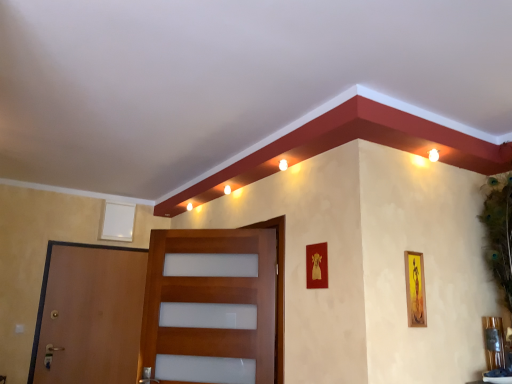
Question: Is the depth of brown wooden door at left, arranged as the first door when viewed from the left, less than that of white matte picture frame at upper left, the first picture frame in the left-to-right sequence?

Choices:
 (A) yes
 (B) no

Answer: (A)

Question: Would you say brown wooden door at left, positioned as the second door in right-to-left order, is outside white matte picture frame at upper left, arranged as the third picture frame when viewed from the right?

Choices:
 (A) yes
 (B) no

Answer: (A)

Question: Is white matte picture frame at upper left, the first picture frame positioned from the back, at the back of brown wooden door at left, which is counted as the first door, starting from the back?

Choices:
 (A) yes
 (B) no

Answer: (B)

Question: Are brown wooden door at left, arranged as the first door when viewed from the left, and white matte picture frame at upper left, arranged as the third picture frame when viewed from the front, far apart?

Choices:
 (A) no
 (B) yes

Answer: (A)

Question: Considering the relative sizes of brown wooden door at left, arranged as the first door when viewed from the left, and white matte picture frame at upper left, arranged as the third picture frame when viewed from the front, in the image provided, is brown wooden door at left, arranged as the first door when viewed from the left, shorter than white matte picture frame at upper left, arranged as the third picture frame when viewed from the front,?

Choices:
 (A) yes
 (B) no

Answer: (B)

Question: Is gold metallic picture frame at center, marked as the second picture frame in a front-to-back arrangement, taller or shorter than yellow matte picture frame at right, which is counted as the first picture frame, starting from the right?

Choices:
 (A) tall
 (B) short

Answer: (B)

Question: Considering the positions of gold metallic picture frame at center, the second picture frame in the back-to-front sequence, and yellow matte picture frame at right, which is counted as the first picture frame, starting from the right, in the image, is gold metallic picture frame at center, the second picture frame in the back-to-front sequence, wider or thinner than yellow matte picture frame at right, which is counted as the first picture frame, starting from the right,?

Choices:
 (A) wide
 (B) thin

Answer: (B)

Question: From the image's perspective, is gold metallic picture frame at center, the second picture frame in the back-to-front sequence, located above or below yellow matte picture frame at right, the third picture frame when ordered from back to front?

Choices:
 (A) below
 (B) above

Answer: (B)

Question: Considering their positions, is gold metallic picture frame at center, marked as the second picture frame in a front-to-back arrangement, located in front of or behind yellow matte picture frame at right, the third picture frame when ordered from back to front?

Choices:
 (A) front
 (B) behind

Answer: (B)

Question: Is wooden door at center, placed as the 2th door when sorted from back to front, taller or shorter than yellow matte picture frame at right, placed as the third picture frame when sorted from left to right?

Choices:
 (A) tall
 (B) short

Answer: (A)

Question: Considering the positions of point (254, 367) and point (416, 317), is point (254, 367) closer or farther from the camera than point (416, 317)?

Choices:
 (A) farther
 (B) closer

Answer: (A)

Question: Would you say wooden door at center, which appears as the first door when viewed from the right, is to the left or to the right of yellow matte picture frame at right, which is the 1th picture frame from front to back, in the picture?

Choices:
 (A) right
 (B) left

Answer: (B)

Question: Is wooden door at center, positioned as the 2th door in left-to-right order, in front of or behind yellow matte picture frame at right, placed as the third picture frame when sorted from left to right, in the image?

Choices:
 (A) front
 (B) behind

Answer: (B)

Question: Is brown wooden door at left, arranged as the first door when viewed from the left, inside the boundaries of yellow matte picture frame at right, placed as the third picture frame when sorted from left to right, or outside?

Choices:
 (A) inside
 (B) outside

Answer: (B)

Question: From the image's perspective, relative to yellow matte picture frame at right, which is counted as the first picture frame, starting from the right, is brown wooden door at left, positioned as the second door in right-to-left order, above or below?

Choices:
 (A) below
 (B) above

Answer: (A)